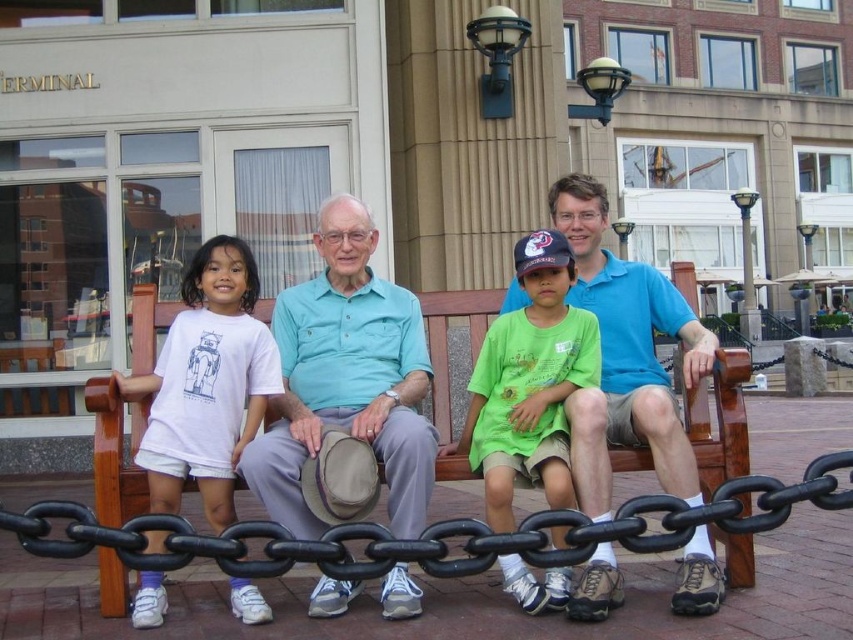
Consider the image. You are standing in front of the black chain barrier at the bottom of the image. You want to approach the people on the bench to ask for directions. Which person should you approach first, the matte blue shirt at center or the white cotton shirt at left?

You should approach the white cotton shirt at left first because the white cotton shirt at left is to the left of the matte blue shirt at center, making them closer to your position on the left side.

You are standing behind the black chain barrier in the foreground and want to see both the matte blue shirt at center and the white cotton shirt at left. Which one can you see more of due to their sizes?

The matte blue shirt at center has a larger size compared to the white cotton shirt at left, so you can see more of the matte blue shirt at center.